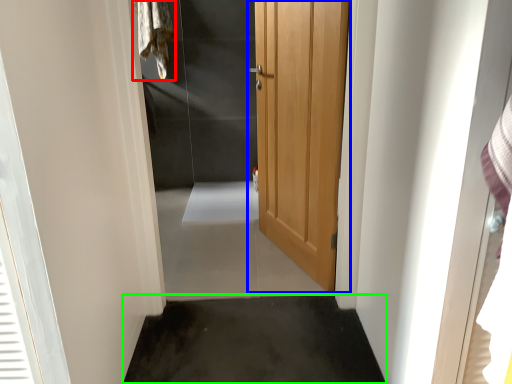
Question: Which is nearer to the laundry (highlighted by a red box)? door (highlighted by a blue box) or concrete (highlighted by a green box).

Choices:
 (A) door
 (B) concrete

Answer: (A)